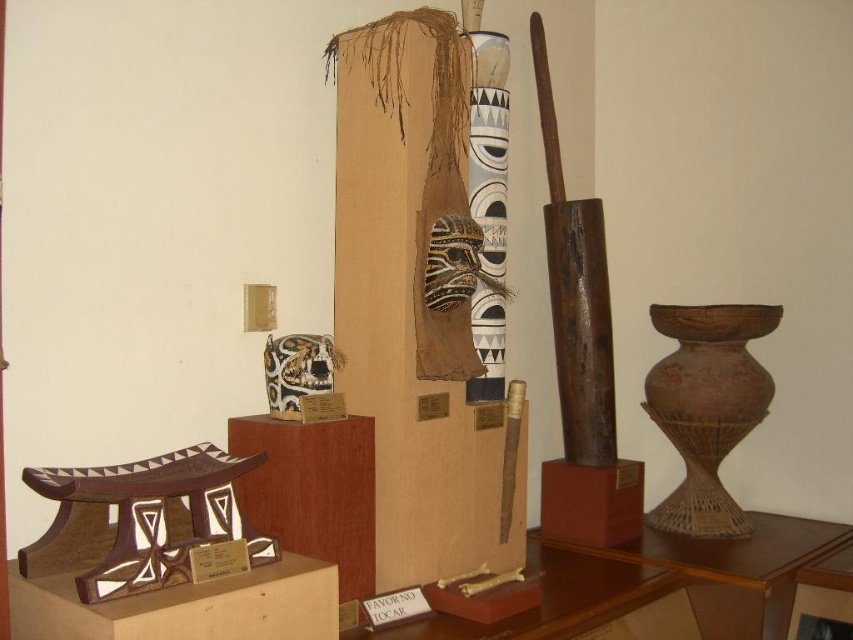
Question: Is wooden totem pole at center thinner than brown woven vase at right?

Choices:
 (A) yes
 (B) no

Answer: (A)

Question: Does brown woven vase at right have a larger size compared to matte brown vase at center?

Choices:
 (A) yes
 (B) no

Answer: (A)

Question: Which of the following is the farthest from the observer?

Choices:
 (A) (610, 422)
 (B) (296, 376)
 (C) (469, 196)

Answer: (A)

Question: Does matte brown vase at center lie behind black woven mask at center?

Choices:
 (A) no
 (B) yes

Answer: (B)

Question: Which point is closer to the camera?

Choices:
 (A) brown woven vase at right
 (B) black woven mask at center
 (C) matte brown vase at center
 (D) wooden totem pole at center

Answer: (B)

Question: Which point appears closest to the camera in this image?

Choices:
 (A) (711, 504)
 (B) (567, 532)

Answer: (B)